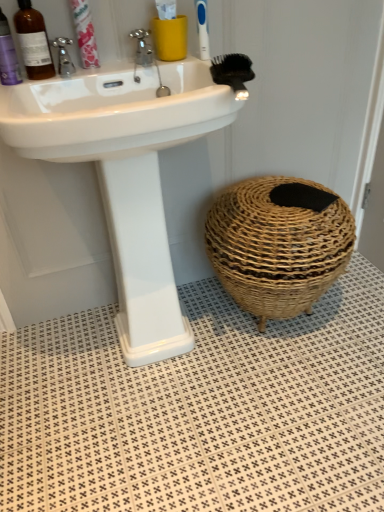
Locate an element on the screen. free location to the left of matte yellow cup at upper center is located at coordinates (127, 64).